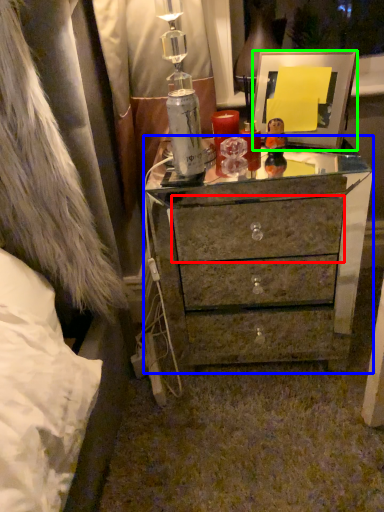
Question: Based on their relative distances, which object is nearer to drawer (highlighted by a red box)? Choose from chest of drawers (highlighted by a blue box) and picture frame (highlighted by a green box).

Choices:
 (A) chest of drawers
 (B) picture frame

Answer: (A)